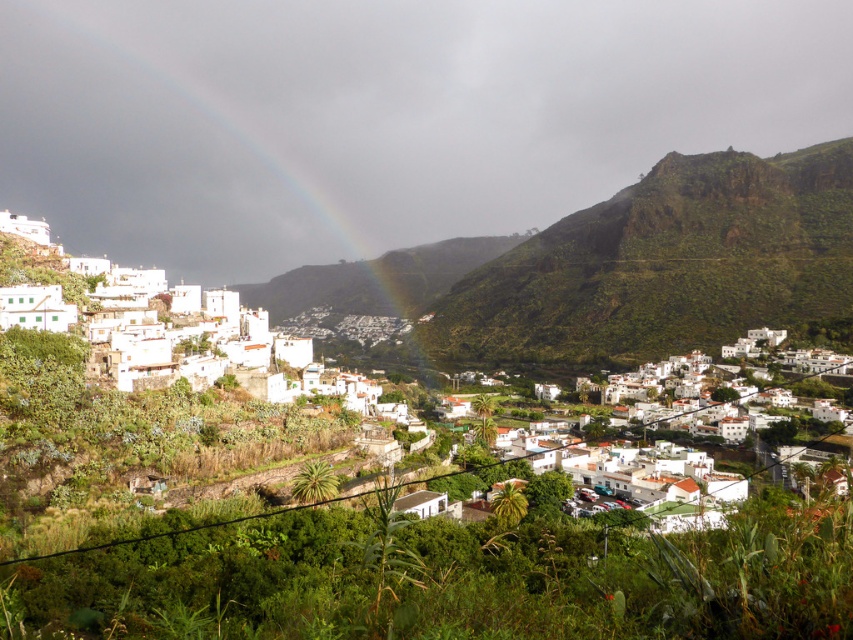
Is rainbow at left to the left of white matte houses at center from the viewer's perspective?

Yes, rainbow at left is to the left of white matte houses at center.

This screenshot has height=640, width=853. I want to click on rainbow at left, so pyautogui.click(x=236, y=129).

Between point (271, 12) and point (38, 259), which one is positioned behind?

The point (271, 12) is more distant.

You are a GUI agent. You are given a task and a screenshot of the screen. Output one action in this format:
    pyautogui.click(x=<x>, y=<y>)
    Task: Click on the rainbow at left
    Image resolution: width=853 pixels, height=640 pixels.
    Given the screenshot: What is the action you would take?
    pyautogui.click(x=236, y=129)